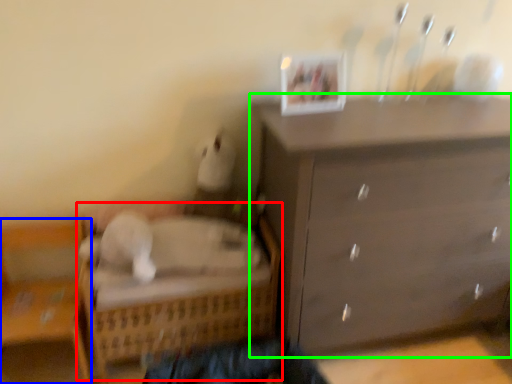
Question: Which is nearer to the bed (highlighted by a red box)? furniture (highlighted by a blue box) or chest of drawers (highlighted by a green box).

Choices:
 (A) furniture
 (B) chest of drawers

Answer: (A)